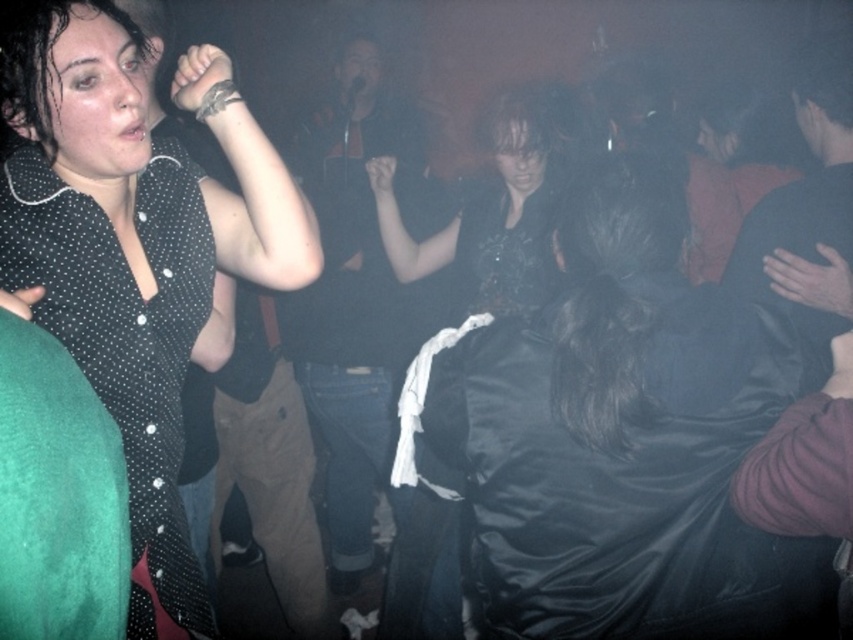
You are a photographer at the music venue and want to capture a wide shot that includes both the shiny black dress at center and the black dotted shirt at upper left. Given their sizes, which object should you focus on to ensure both fit in the frame?

The shiny black dress at center is wider than the black dotted shirt at upper left, so focusing on the shiny black dress at center would ensure both fit in the frame as it requires more space.

You are a photographer at the music venue and want to take a photo of the shiny black dress at center. Where should you aim your camera to capture it?

You should aim your camera at point 0.683 on the x axis and 0.735 on the y axis to capture the shiny black dress at center.